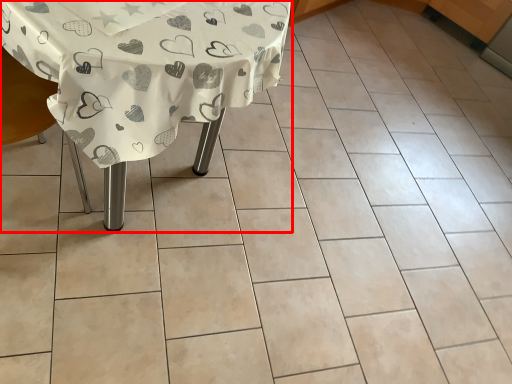
Question: Where is table (annotated by the red box) located in relation to armchair in the image?

Choices:
 (A) left
 (B) right

Answer: (B)